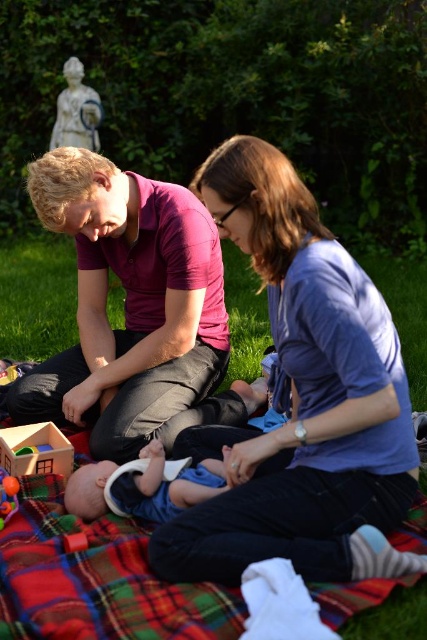
You are a parent trying to reach the wooden house at lower left while holding the white plastic bib at center. Can you reach it without moving your feet?

→ The distance between the white plastic bib at center and the wooden house at lower left is 15.57 inches, so yes, you can reach the wooden house at lower left without moving your feet since 15.57 inches is within typical arm reach.

You are a photographer trying to capture the blue cotton shirt at center and the wooden block at lower left in the same frame. Can you see both objects clearly without moving your camera position?

The blue cotton shirt at center is positioned over the wooden block at lower left, so the shirt may block the view of the wooden block at lower left depending on the camera angle.

You are organizing a picnic and need to decide which item to place first. Given the blue cotton shirt at center and the wooden block at lower left, which item should you place first if you want to put the larger item first?

The blue cotton shirt at center is larger in size than the wooden block at lower left, so you should place the blue cotton shirt at center first.